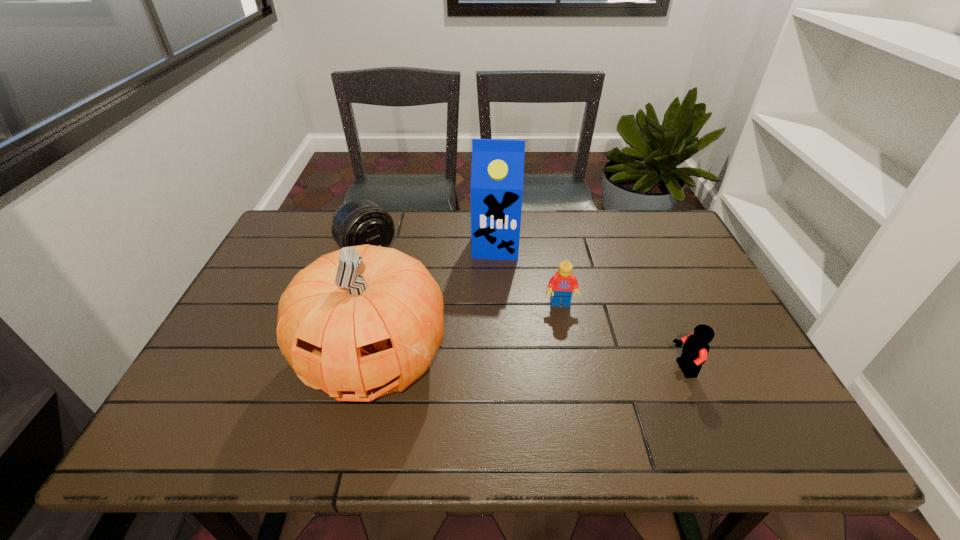
You are a GUI agent. You are given a task and a screenshot of the screen. Output one action in this format:
    pyautogui.click(x=<x>, y=<y>)
    Task: Click on the object that is the third nearest to the telephoto lens
    The width and height of the screenshot is (960, 540).
    Given the screenshot: What is the action you would take?
    pyautogui.click(x=561, y=285)

Identify the location of object that stands as the closest to the rightmost object. (561, 285).

The width and height of the screenshot is (960, 540). Identify the location of vacant region that satisfies the following two spatial constraints: 1. on the front-facing side of the rightmost object; 2. on the front-facing side of the pumpkin. (372, 369).

At what (x,y) coordinates should I click in order to perform the action: click on free location that satisfies the following two spatial constraints: 1. on the front-facing side of the rightmost object; 2. on the front-facing side of the pumpkin. Please return your answer as a coordinate pair (x, y). Image resolution: width=960 pixels, height=540 pixels. Looking at the image, I should click on (372, 369).

Where is `free space that satisfies the following two spatial constraints: 1. on the front-facing side of the pumpkin; 2. on the front-facing side of the rightmost object`? This screenshot has height=540, width=960. free space that satisfies the following two spatial constraints: 1. on the front-facing side of the pumpkin; 2. on the front-facing side of the rightmost object is located at coordinates click(x=372, y=369).

Where is `vacant area that satisfies the following two spatial constraints: 1. on the front-facing side of the nearer Lego; 2. on the front-facing side of the pumpkin`? The width and height of the screenshot is (960, 540). vacant area that satisfies the following two spatial constraints: 1. on the front-facing side of the nearer Lego; 2. on the front-facing side of the pumpkin is located at coordinates (372, 369).

This screenshot has height=540, width=960. In order to click on vacant region that satisfies the following two spatial constraints: 1. on the front side of the farther Lego; 2. on the right side of the third object from right to left in this screenshot , I will do `click(498, 305)`.